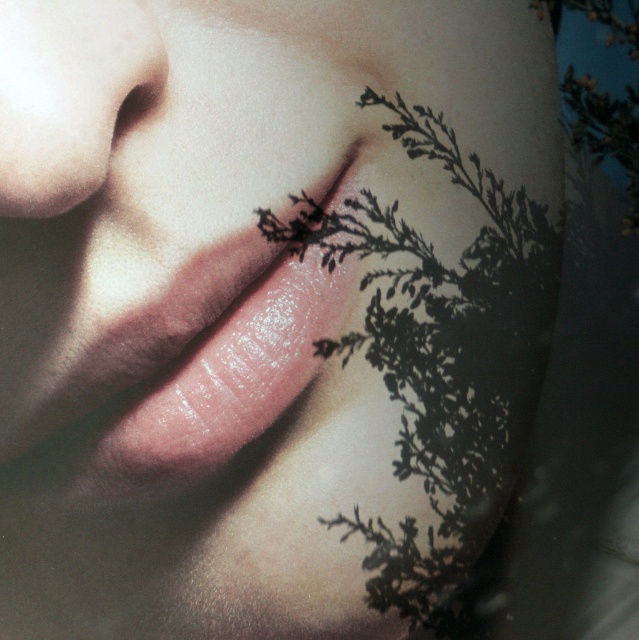
Which is in front, point (424, 403) or point (204, 448)?

Point (204, 448) is in front.

Between black matte plant at lower right and glossy pink lips at center, which one has more height?

Standing taller between the two is black matte plant at lower right.

Is point (512, 376) closer to camera compared to point (132, 436)?

That is False.

This screenshot has height=640, width=639. Identify the location of black matte plant at lower right. (440, 358).

Looking at this image, between black matte plant at lower right and smooth skin nose at upper left, which one is positioned higher?

smooth skin nose at upper left

Is black matte plant at lower right further to the viewer compared to smooth skin nose at upper left?

Yes, it is.

Is point (472, 269) farther from viewer compared to point (142, 68)?

Yes, it is.

I want to click on black matte plant at lower right, so click(x=440, y=358).

Who is higher up, glossy pink lips at center or smooth skin nose at upper left?

smooth skin nose at upper left is higher up.

Who is positioned more to the left, glossy pink lips at center or smooth skin nose at upper left?

Positioned to the left is smooth skin nose at upper left.

Describe the element at coordinates (227, 362) in the screenshot. The width and height of the screenshot is (639, 640). I see `glossy pink lips at center` at that location.

Locate an element on the screen. Image resolution: width=639 pixels, height=640 pixels. glossy pink lips at center is located at coordinates (227, 362).